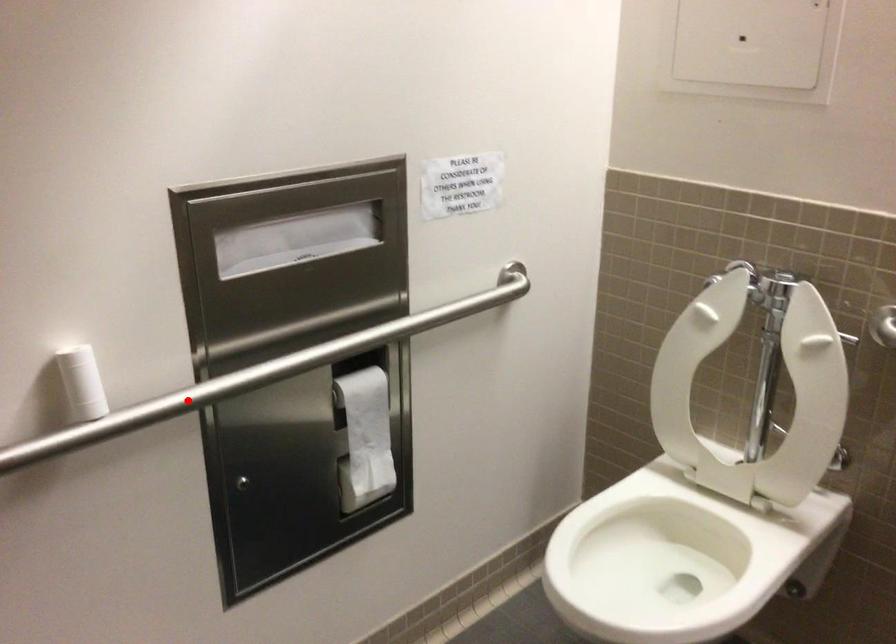
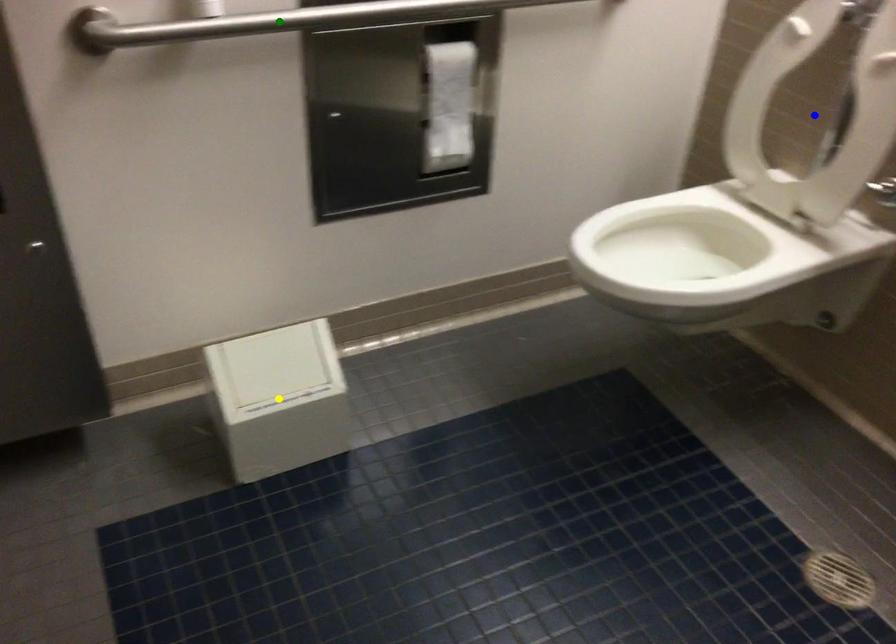
Question: I am providing you with two images of the same scene from different viewpoints. A red point is marked on the first image. You are given multiple points on the second image. Can you choose the point in image 2 that corresponds to the point in image 1?

Choices:
 (A) green point
 (B) blue point
 (C) yellow point

Answer: (A)